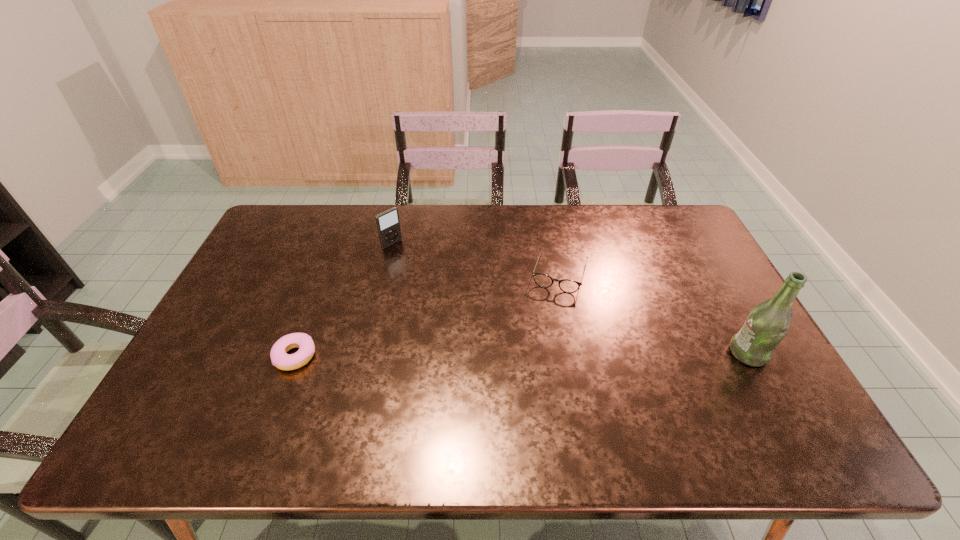
Where is `free point located 0.380m on the front-facing side of the third shortest object`? The width and height of the screenshot is (960, 540). free point located 0.380m on the front-facing side of the third shortest object is located at coordinates (473, 309).

This screenshot has width=960, height=540. I want to click on vacant area located on the front-facing side of the third shortest object, so click(x=435, y=278).

Identify the location of free region located 0.080m through the lenses of the second farthest object. This screenshot has width=960, height=540. (548, 313).

In order to click on free space located through the lenses of the second farthest object in this screenshot , I will do `click(539, 344)`.

At what (x,y) coordinates should I click in order to perform the action: click on free spot located through the lenses of the second farthest object. Please return your answer as a coordinate pair (x, y). Looking at the image, I should click on (548, 313).

Identify the location of object at the far edge. The height and width of the screenshot is (540, 960). (388, 224).

You are a GUI agent. You are given a task and a screenshot of the screen. Output one action in this format:
    pyautogui.click(x=<x>, y=<y>)
    Task: Click on the object that is positioned at the right edge
    
    Given the screenshot: What is the action you would take?
    pyautogui.click(x=767, y=324)

At what (x,y) coordinates should I click in order to perform the action: click on free region at the far edge of the desktop. Please return your answer as a coordinate pair (x, y). Image resolution: width=960 pixels, height=540 pixels. Looking at the image, I should click on (415, 244).

At what (x,y) coordinates should I click in order to perform the action: click on vacant space at the near edge of the desktop. Please return your answer as a coordinate pair (x, y). This screenshot has width=960, height=540. Looking at the image, I should click on coord(310,386).

In the image, there is a desktop. Where is `blank space at the left edge`? blank space at the left edge is located at coordinates (291, 274).